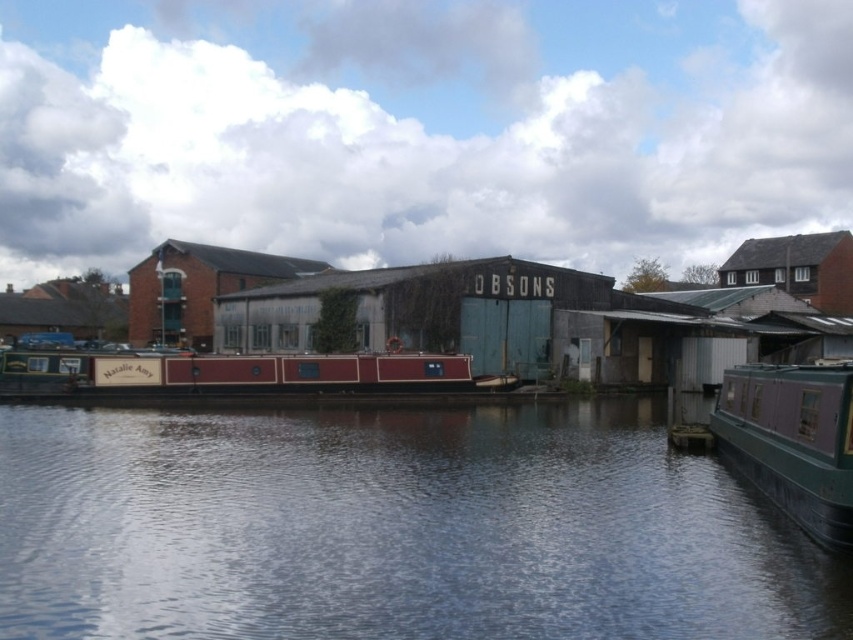
The height and width of the screenshot is (640, 853). What do you see at coordinates (393, 529) in the screenshot?
I see `smooth water at center` at bounding box center [393, 529].

Which is below, smooth water at center or green matte barge at right?

smooth water at center

Where is `smooth water at center`? smooth water at center is located at coordinates (393, 529).

The image size is (853, 640). Find the location of `smooth water at center`. smooth water at center is located at coordinates (393, 529).